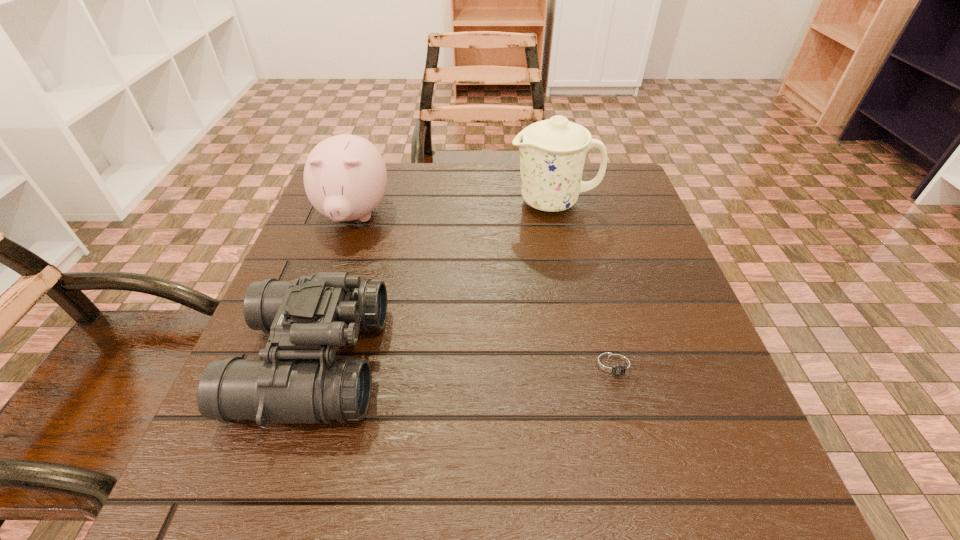
The height and width of the screenshot is (540, 960). I want to click on free space that is in between the binoculars and the watch, so click(x=465, y=363).

The width and height of the screenshot is (960, 540). What are the coordinates of `vacant area that lies between the chinaware and the watch` in the screenshot? It's located at (585, 284).

Where is `vacant point located between the third shortest object and the chinaware`? vacant point located between the third shortest object and the chinaware is located at coordinates (454, 209).

Locate an element on the screen. Image resolution: width=960 pixels, height=540 pixels. the closest object relative to the third tallest object is located at coordinates (345, 177).

Select which object appears as the third closest to the third tallest object. Please provide its 2D coordinates. Your answer should be formatted as a tuple, i.e. [(x, y)], where the tuple contains the x and y coordinates of a point satisfying the conditions above.

[(615, 366)]

Where is `blank area in the image that satisfies the following two spatial constraints: 1. on the spout of the chinaware; 2. at the snout of the piggy bank`? This screenshot has height=540, width=960. blank area in the image that satisfies the following two spatial constraints: 1. on the spout of the chinaware; 2. at the snout of the piggy bank is located at coordinates point(556,215).